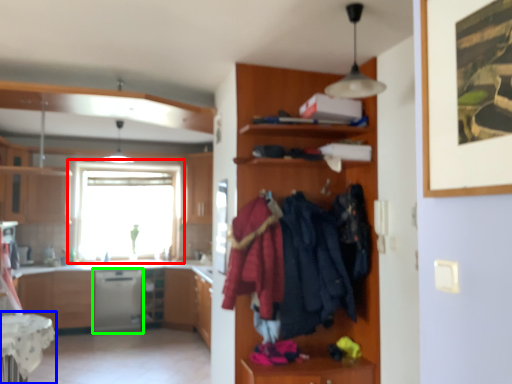
Question: Which object is positioned closest to window (highlighted by a red box)? Select from table (highlighted by a blue box) and dish washer (highlighted by a green box).

Choices:
 (A) table
 (B) dish washer

Answer: (B)